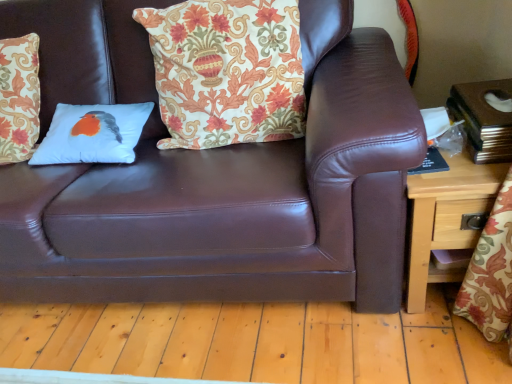
Question: Is white matte pillow with bird design at center, which ranks as the 2th pillow in right-to-left order, located outside wooden side table at right?

Choices:
 (A) no
 (B) yes

Answer: (B)

Question: Is white matte pillow with bird design at center, which ranks as the first pillow in left-to-right order, in front of wooden side table at right?

Choices:
 (A) yes
 (B) no

Answer: (B)

Question: Considering the relative sizes of white matte pillow with bird design at center, which ranks as the 2th pillow in right-to-left order, and wooden side table at right in the image provided, is white matte pillow with bird design at center, which ranks as the 2th pillow in right-to-left order, smaller than wooden side table at right?

Choices:
 (A) no
 (B) yes

Answer: (B)

Question: Does white matte pillow with bird design at center, which ranks as the 2th pillow in right-to-left order, have a lesser width compared to wooden side table at right?

Choices:
 (A) no
 (B) yes

Answer: (B)

Question: From a real-world perspective, does white matte pillow with bird design at center, which ranks as the 2th pillow in right-to-left order, stand above wooden side table at right?

Choices:
 (A) yes
 (B) no

Answer: (A)

Question: Considering the positions of white matte pillow with bird design at center, which ranks as the first pillow in left-to-right order, and brown leather couch at center in the image, is white matte pillow with bird design at center, which ranks as the first pillow in left-to-right order, wider or thinner than brown leather couch at center?

Choices:
 (A) wide
 (B) thin

Answer: (B)

Question: Does point (53, 115) appear closer or farther from the camera than point (3, 266)?

Choices:
 (A) closer
 (B) farther

Answer: (B)

Question: Visually, is white matte pillow with bird design at center, which ranks as the 2th pillow in right-to-left order, positioned to the left or to the right of brown leather couch at center?

Choices:
 (A) left
 (B) right

Answer: (A)

Question: Looking at the image, does white matte pillow with bird design at center, which ranks as the 2th pillow in right-to-left order, seem bigger or smaller compared to brown leather couch at center?

Choices:
 (A) small
 (B) big

Answer: (A)

Question: Is brown leather couch at center situated inside white matte pillow with bird design at center, which ranks as the first pillow in left-to-right order, or outside?

Choices:
 (A) outside
 (B) inside

Answer: (A)

Question: Considering the positions of brown leather couch at center and white matte pillow with bird design at center, which ranks as the first pillow in left-to-right order, in the image, is brown leather couch at center taller or shorter than white matte pillow with bird design at center, which ranks as the first pillow in left-to-right order,?

Choices:
 (A) tall
 (B) short

Answer: (A)

Question: From a real-world perspective, relative to white matte pillow with bird design at center, which ranks as the first pillow in left-to-right order, is brown leather couch at center vertically above or below?

Choices:
 (A) below
 (B) above

Answer: (A)

Question: Based on their sizes in the image, would you say brown leather couch at center is bigger or smaller than white matte pillow with bird design at center, which ranks as the first pillow in left-to-right order?

Choices:
 (A) big
 (B) small

Answer: (A)

Question: Which is correct: wooden side table at right is inside brown leather couch at center, or outside of it?

Choices:
 (A) outside
 (B) inside

Answer: (A)

Question: In the image, is wooden side table at right positioned in front of or behind brown leather couch at center?

Choices:
 (A) front
 (B) behind

Answer: (B)